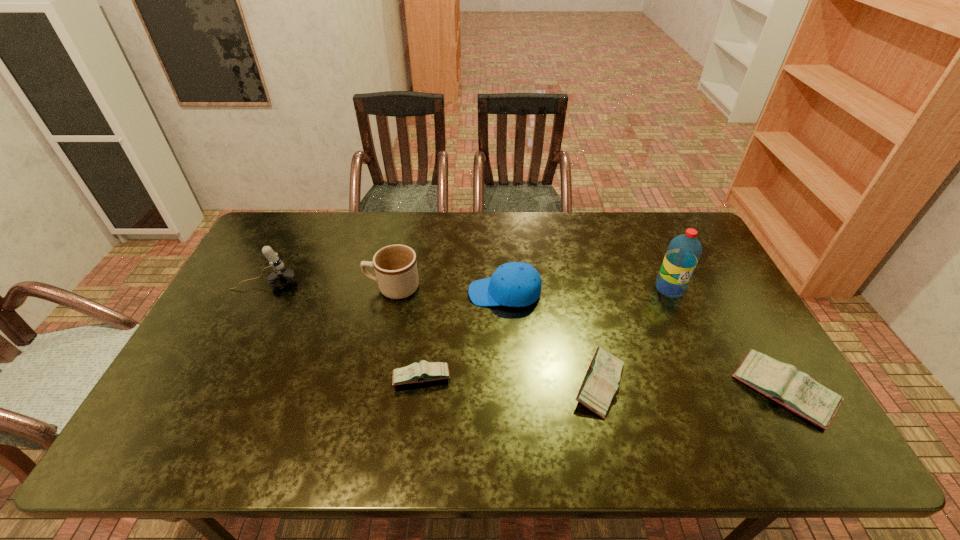
This screenshot has width=960, height=540. Identify the location of the leftmost diary. (424, 371).

The width and height of the screenshot is (960, 540). I want to click on the shortest object, so click(x=424, y=371).

At what (x,y) coordinates should I click in order to perform the action: click on the second shortest object. Please return your answer as a coordinate pair (x, y). The height and width of the screenshot is (540, 960). Looking at the image, I should click on (600, 384).

Identify the location of the second shortest diary. tap(600, 384).

At what (x,y) coordinates should I click in order to perform the action: click on the tallest diary. Please return your answer as a coordinate pair (x, y). Looking at the image, I should click on (797, 391).

I want to click on the fifth tallest object, so click(x=797, y=391).

Find the location of a particular element. This screenshot has height=540, width=960. cap is located at coordinates (515, 284).

I want to click on the fourth object from right to left, so click(515, 284).

The height and width of the screenshot is (540, 960). In order to click on water bottle in this screenshot , I will do `click(683, 253)`.

Where is `the tallest object`? The width and height of the screenshot is (960, 540). the tallest object is located at coordinates tap(683, 253).